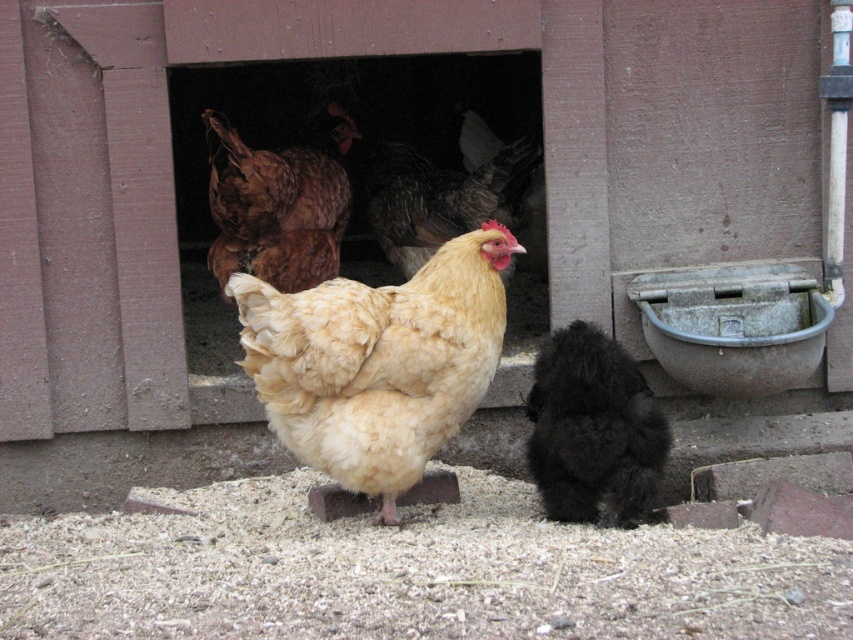
Is point (592, 499) more distant than point (426, 259)?

No.

Is black fluffy chicken at lower center shorter than brown feathered chicken at center?

No, black fluffy chicken at lower center is not shorter than brown feathered chicken at center.

Who is more forward, (537, 452) or (368, 188)?

Point (537, 452) is more forward.

You are a GUI agent. You are given a task and a screenshot of the screen. Output one action in this format:
    pyautogui.click(x=<x>, y=<y>)
    Task: Click on the black fluffy chicken at lower center
    Image resolution: width=853 pixels, height=640 pixels.
    Given the screenshot: What is the action you would take?
    pyautogui.click(x=593, y=429)

Measure the distance from black fluffy chicken at lower center to brown feathered chicken at upper center.

They are 1.10 meters apart.

Does black fluffy chicken at lower center come in front of brown feathered chicken at upper center?

Yes, black fluffy chicken at lower center is in front of brown feathered chicken at upper center.

Which is in front, point (637, 481) or point (325, 260)?

Point (637, 481) is more forward.

The height and width of the screenshot is (640, 853). Find the location of `black fluffy chicken at lower center`. black fluffy chicken at lower center is located at coordinates (593, 429).

Based on the photo, can you confirm if brown feathered chicken at upper center is positioned below brown feathered chicken at center?

Incorrect, brown feathered chicken at upper center is not positioned below brown feathered chicken at center.

Who is positioned more to the right, brown feathered chicken at upper center or brown feathered chicken at center?

brown feathered chicken at center is more to the right.

Where is `brown feathered chicken at upper center`? This screenshot has height=640, width=853. brown feathered chicken at upper center is located at coordinates (277, 204).